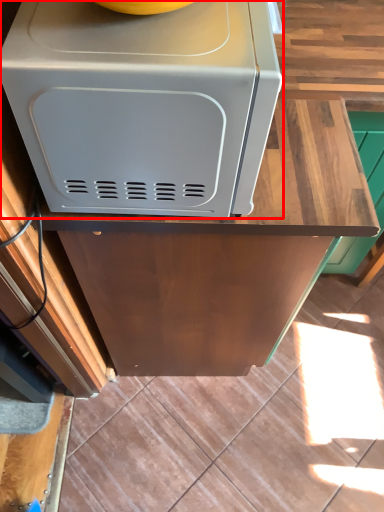
Question: From the image's perspective, what is the correct spatial relationship of home appliance (annotated by the red box) in relation to counter?

Choices:
 (A) below
 (B) above

Answer: (B)